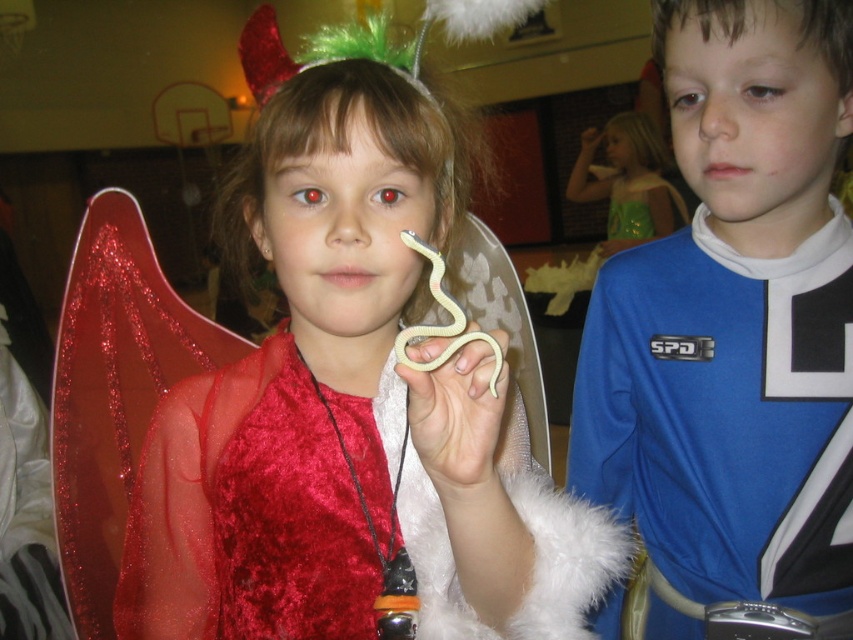
Looking at this image, you are a photographer at the event and need to decide which costume will show more detail in the photo. Based on their thickness, which one between the blue jersey at center and the green velvet dress at upper right is thicker?

The green velvet dress at upper right is thicker than the blue jersey at center, so it will show more detail in the photo.

You are a photographer at the party and need to take a group photo of the blue jersey at center and the white matte snake at center. The camera you have can focus on objects within 12 inches of each other. Will both subjects be in focus?

The distance between the blue jersey at center and the white matte snake at center is 18.44 inches. Since the camera requires subjects to be within 12 inches of each other for both to be in focus, they are too far apart. Adjust their positions to reduce the distance between them.

You are a photographer at the party and want to take a photo of the velvet red dress at center and the matte yellow plastic snake at upper center. Which object should you focus on first if you want to capture both clearly in the same frame?

The velvet red dress at center is located below the matte yellow plastic snake at upper center, so you should focus on the matte yellow plastic snake at upper center first to ensure both are in focus since it is closer to the camera.